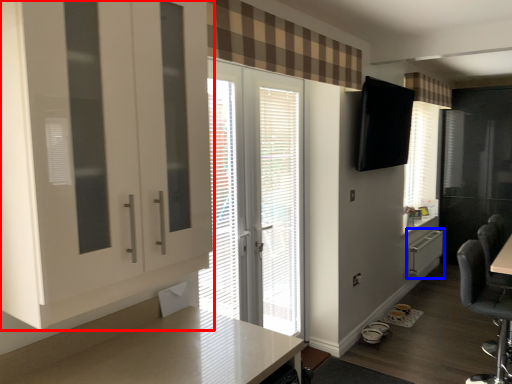
Question: Which object appears farthest to the camera in this image, cabinetry (highlighted by a red box) or file cabinet (highlighted by a blue box)?

Choices:
 (A) cabinetry
 (B) file cabinet

Answer: (B)